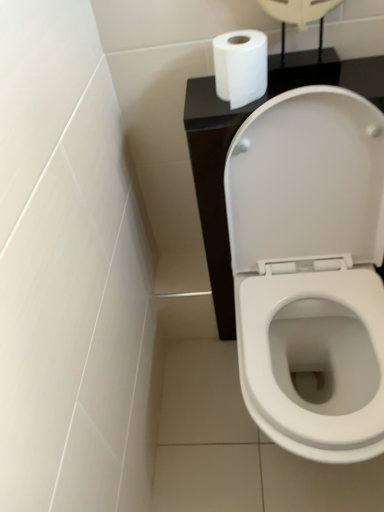
This screenshot has height=512, width=384. Describe the element at coordinates (310, 268) in the screenshot. I see `white glossy toilet at center` at that location.

The height and width of the screenshot is (512, 384). I want to click on white glossy toilet at center, so click(310, 268).

What do you see at coordinates (240, 66) in the screenshot?
I see `white matte toilet paper at upper right` at bounding box center [240, 66].

The image size is (384, 512). What are the coordinates of `white matte toilet paper at upper right` in the screenshot? It's located at pyautogui.click(x=240, y=66).

The width and height of the screenshot is (384, 512). Find the location of `white glossy toilet at center`. white glossy toilet at center is located at coordinates (310, 268).

Which object is positioned more to the left, white glossy toilet at center or white matte toilet paper at upper right?

white matte toilet paper at upper right.

Considering the relative positions of white glossy toilet at center and white matte toilet paper at upper right in the image provided, is white glossy toilet at center in front of white matte toilet paper at upper right?

Yes, the depth of white glossy toilet at center is less than that of white matte toilet paper at upper right.

Considering the points (262, 296) and (261, 77), which point is behind, point (262, 296) or point (261, 77)?

The point (262, 296) is farther.

From the image's perspective, is white glossy toilet at center on top of white matte toilet paper at upper right?

Actually, white glossy toilet at center appears below white matte toilet paper at upper right in the image.

From a real-world perspective, is white glossy toilet at center on top of white matte toilet paper at upper right?

No, from a real-world perspective, white glossy toilet at center is not on top of white matte toilet paper at upper right.

Is white glossy toilet at center wider or thinner than white matte toilet paper at upper right?

Considering their sizes, white glossy toilet at center looks broader than white matte toilet paper at upper right.

Is white glossy toilet at center taller or shorter than white matte toilet paper at upper right?

Considering their sizes, white glossy toilet at center has more height than white matte toilet paper at upper right.

Considering the relative sizes of white glossy toilet at center and white matte toilet paper at upper right in the image provided, is white glossy toilet at center smaller than white matte toilet paper at upper right?

No, white glossy toilet at center is not smaller than white matte toilet paper at upper right.

Is white glossy toilet at center inside the boundaries of white matte toilet paper at upper right, or outside?

white glossy toilet at center is outside white matte toilet paper at upper right.

Is white glossy toilet at center positioned far away from white matte toilet paper at upper right?

They are positioned close to each other.

Is white glossy toilet at center oriented away from white matte toilet paper at upper right?

No, white glossy toilet at center is not facing away from white matte toilet paper at upper right.

How much distance is there between white glossy toilet at center and white matte toilet paper at upper right?

white glossy toilet at center is 14.20 inches from white matte toilet paper at upper right.

What are the coordinates of `toilet paper above the white glossy toilet at center (from a real-world perspective)` in the screenshot? It's located at (240, 66).

Is white matte toilet paper at upper right to the left or to the right of white glossy toilet at center in the image?

white matte toilet paper at upper right is positioned on white glossy toilet at center's left side.

From the picture: Which is behind, white matte toilet paper at upper right or white glossy toilet at center?

white matte toilet paper at upper right is more distant.

Which is in front, point (260, 38) or point (349, 170)?

Point (260, 38)

From the image's perspective, is white matte toilet paper at upper right beneath white glossy toilet at center?

No, from the image's perspective, white matte toilet paper at upper right is not beneath white glossy toilet at center.

From a real-world perspective, does white matte toilet paper at upper right stand above white glossy toilet at center?

Yes, from a real-world perspective, white matte toilet paper at upper right is above white glossy toilet at center.

Which object is wider, white matte toilet paper at upper right or white glossy toilet at center?

Wider between the two is white glossy toilet at center.

Can you confirm if white matte toilet paper at upper right is shorter than white glossy toilet at center?

Correct, white matte toilet paper at upper right is not as tall as white glossy toilet at center.

Does white matte toilet paper at upper right have a smaller size compared to white glossy toilet at center?

Yes.

Could white glossy toilet at center be considered to be inside white matte toilet paper at upper right?

No.

Is white matte toilet paper at upper right with white glossy toilet at center?

No, white matte toilet paper at upper right is not touching white glossy toilet at center.

Is white matte toilet paper at upper right looking in the opposite direction of white glossy toilet at center?

No, white glossy toilet at center is not at the back of white matte toilet paper at upper right.

How different are the orientations of white matte toilet paper at upper right and white glossy toilet at center in degrees?

The angle between the facing direction of white matte toilet paper at upper right and the facing direction of white glossy toilet at center is 2.72 degrees.

How much distance is there between white matte toilet paper at upper right and white glossy toilet at center?

white matte toilet paper at upper right and white glossy toilet at center are 14.20 inches apart from each other.

Locate an element on the screen. The height and width of the screenshot is (512, 384). toilet paper above the white glossy toilet at center (from the image's perspective) is located at coordinates (240, 66).

There is a white glossy toilet at center. What are the coordinates of `toilet paper above it (from a real-world perspective)` in the screenshot? It's located at (240, 66).

Find the location of a particular element. The width and height of the screenshot is (384, 512). toilet below the white matte toilet paper at upper right (from a real-world perspective) is located at coordinates click(310, 268).